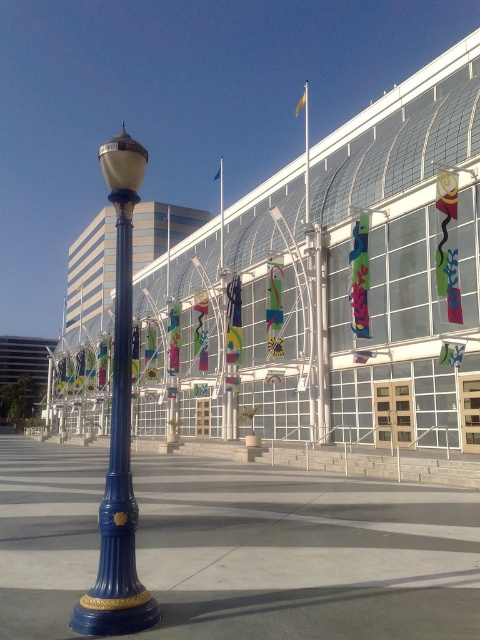
You are standing in front of the blue glass building at center and want to walk to the blue concrete pavement at lower left. Which direction should you move relative to the building?

The blue concrete pavement at lower left is located behind the blue glass building at center, so you should move towards the direction away from the building to reach it.

You are standing at the entrance of the convention center and see two points marked in the scene. The first point is located at coordinate point (187, 248) and the second at point (194, 476). Which point is closer to you?

Point (187, 248) is further to the camera than point (194, 476), so the point closer to you is point (194, 476).

You are standing at point [334,300] in the plaza. What is the nearest object to you?

The nearest object to you at point [334,300] is the blue glass building at center, as it is located precisely at that coordinate.